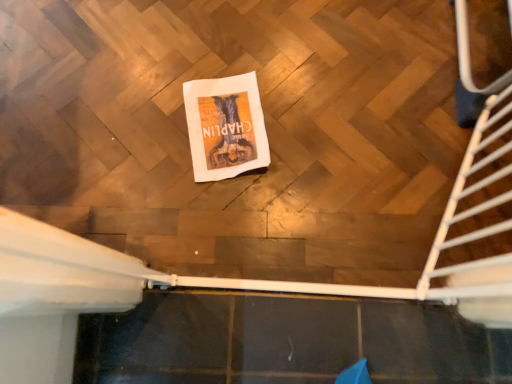
Locate an element on the screen. white metal stairs at right is located at coordinates (477, 211).

What do you see at coordinates (477, 211) in the screenshot? The width and height of the screenshot is (512, 384). I see `white metal stairs at right` at bounding box center [477, 211].

Measure the distance between point (482, 262) and camera.

Point (482, 262) and camera are 36.06 inches apart from each other.

Find the location of a particular element. The width and height of the screenshot is (512, 384). white paper towel at center is located at coordinates (225, 127).

Image resolution: width=512 pixels, height=384 pixels. What do you see at coordinates (225, 127) in the screenshot?
I see `white paper towel at center` at bounding box center [225, 127].

Locate an element on the screen. This screenshot has width=512, height=384. white metal stairs at right is located at coordinates (477, 211).

Is white metal stairs at right to the right of white paper towel at center from the viewer's perspective?

Correct, you'll find white metal stairs at right to the right of white paper towel at center.

Which object is more forward, white metal stairs at right or white paper towel at center?

white metal stairs at right is more forward.

Is point (490, 129) more distant than point (245, 120)?

No, it is not.

From the image's perspective, which one is positioned lower, white metal stairs at right or white paper towel at center?

white metal stairs at right.

From a real-world perspective, which object rests below the other?

white paper towel at center is physically lower.

Which object is wider, white metal stairs at right or white paper towel at center?

white paper towel at center.

In terms of height, does white metal stairs at right look taller or shorter compared to white paper towel at center?

Clearly, white metal stairs at right is taller compared to white paper towel at center.

Looking at the image, does white metal stairs at right seem bigger or smaller compared to white paper towel at center?

white metal stairs at right is bigger than white paper towel at center.

Based on the photo, is white metal stairs at right inside or outside of white paper towel at center?

white metal stairs at right is located beyond the bounds of white paper towel at center.

Is white metal stairs at right not near white paper towel at center?

No, white metal stairs at right is in close proximity to white paper towel at center.

Looking at this image, is white paper towel at center at the back of white metal stairs at right?

No.

Consider the image. What's the angular difference between white metal stairs at right and white paper towel at center's facing directions?

The angle between the facing direction of white metal stairs at right and the facing direction of white paper towel at center is 56.7 degrees.

Image resolution: width=512 pixels, height=384 pixels. I want to click on flyer behind the white metal stairs at right, so click(225, 127).

Based on the photo, is white paper towel at center to the left or to the right of white metal stairs at right in the image?

Clearly, white paper towel at center is on the left of white metal stairs at right in the image.

Relative to white metal stairs at right, is white paper towel at center in front or behind?

white paper towel at center is behind white metal stairs at right.

Between point (227, 148) and point (449, 223), which one is positioned behind?

Positioned behind is point (227, 148).

From the image's perspective, which object appears higher, white paper towel at center or white metal stairs at right?

white paper towel at center appears higher in the image.

From a real-world perspective, is white paper towel at center physically located above or below white metal stairs at right?

In terms of real-world spatial position, white paper towel at center is below white metal stairs at right.

Is white paper towel at center wider or thinner than white metal stairs at right?

In the image, white paper towel at center appears to be wider than white metal stairs at right.

Is white paper towel at center shorter than white metal stairs at right?

Correct, white paper towel at center is not as tall as white metal stairs at right.

Considering the relative sizes of white paper towel at center and white metal stairs at right in the image provided, is white paper towel at center smaller than white metal stairs at right?

Yes, white paper towel at center is smaller than white metal stairs at right.

Is white metal stairs at right completely or partially inside white paper towel at center?

That's incorrect, white metal stairs at right is not inside white paper towel at center.

Would you consider white paper towel at center to be distant from white metal stairs at right?

white paper towel at center is actually quite close to white metal stairs at right.

Is white paper towel at center oriented away from white metal stairs at right?

No, white paper towel at center is not facing away from white metal stairs at right.

You are a GUI agent. You are given a task and a screenshot of the screen. Output one action in this format:
    pyautogui.click(x=<x>, y=<y>)
    Task: Click on the flyer above the white metal stairs at right (from the image's perspective)
    
    Given the screenshot: What is the action you would take?
    pyautogui.click(x=225, y=127)

The image size is (512, 384). Identify the location of flyer below the white metal stairs at right (from a real-world perspective). (225, 127).

The width and height of the screenshot is (512, 384). What are the coordinates of `stairs above the white paper towel at center (from a real-world perspective)` in the screenshot? It's located at (477, 211).